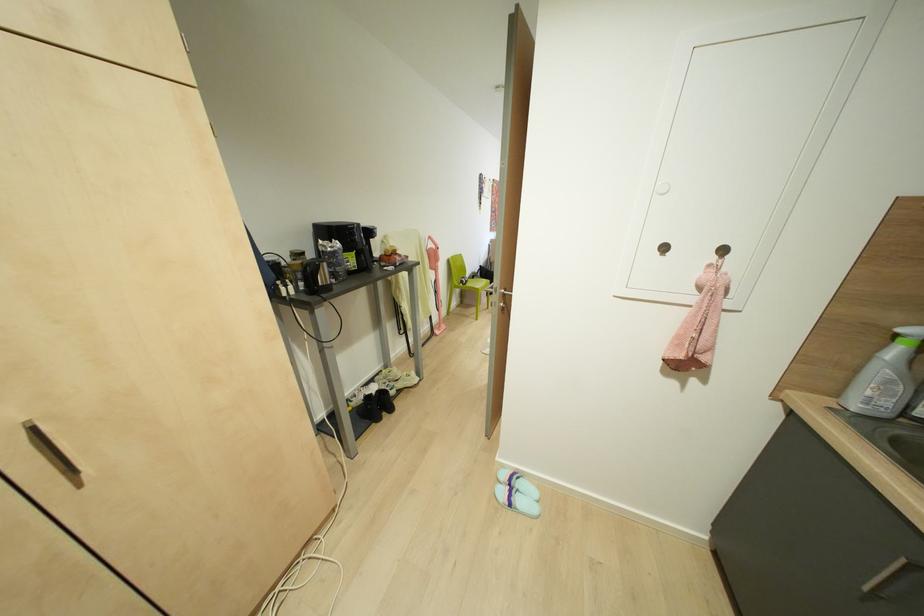
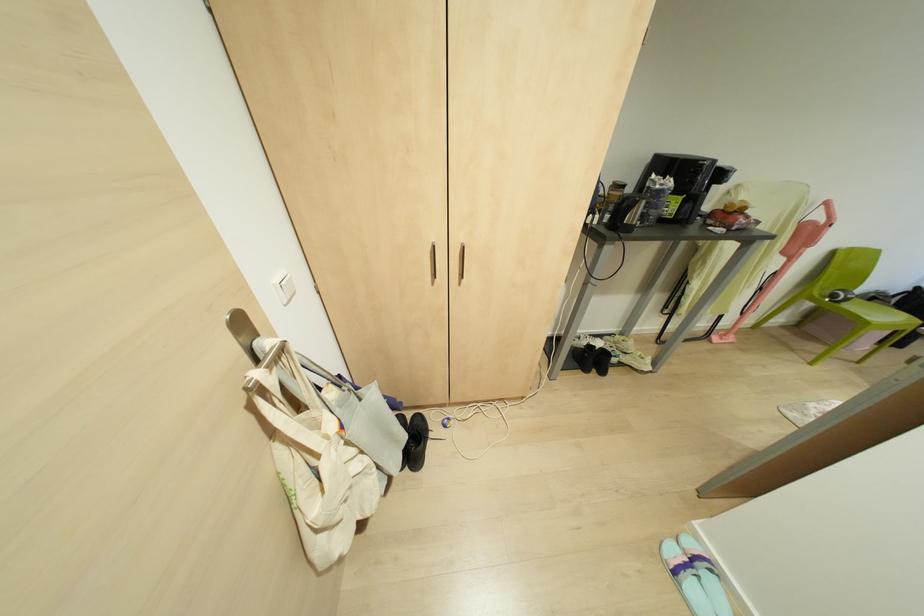
Question: I am providing you with two images of the same scene from different viewpoints. After the viewpoint changes to image2, which objects are now occluded?

Choices:
 (A) white sneaker
 (B) white light switch
 (C) beige tote bag
 (D) none of these

Answer: (D)